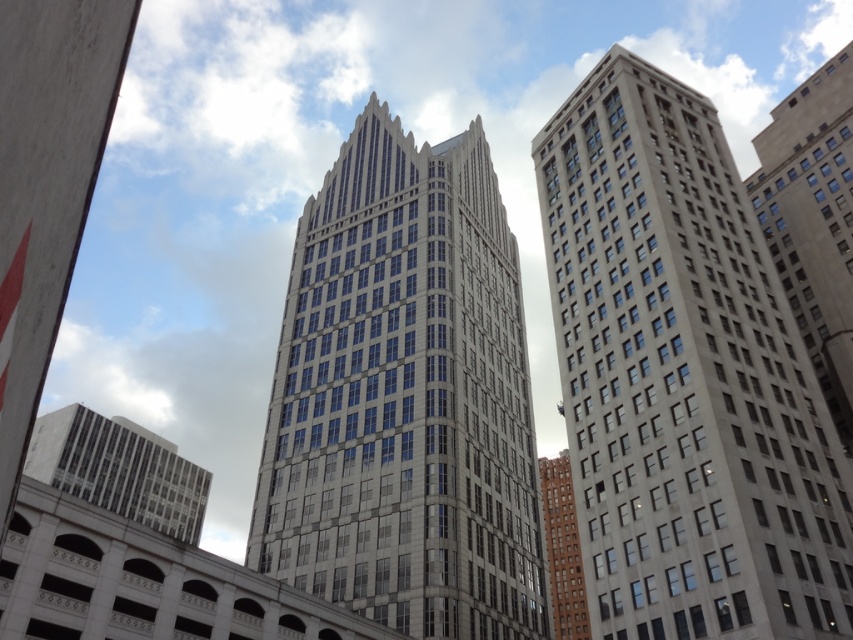
Question: Based on their relative distances, which object is farther from the brown brick building at center?

Choices:
 (A) white glass building at lower left
 (B) gray stone skyscraper at center
 (C) gray concrete building at right

Answer: (A)

Question: Which point appears closest to the camera in this image?

Choices:
 (A) (57, 483)
 (B) (412, 211)
 (C) (779, 192)

Answer: (C)

Question: Does gray stone building at right appear on the left side of gray stone skyscraper at center?

Choices:
 (A) yes
 (B) no

Answer: (B)

Question: Considering the real-world distances, which object is closest to the white glass building at lower left?

Choices:
 (A) brown brick building at center
 (B) gray concrete building at right

Answer: (A)

Question: Is gray concrete building at right closer to camera compared to white glass building at lower left?

Choices:
 (A) yes
 (B) no

Answer: (A)

Question: Where is gray stone building at right located in relation to gray concrete building at right in the image?

Choices:
 (A) above
 (B) below

Answer: (B)